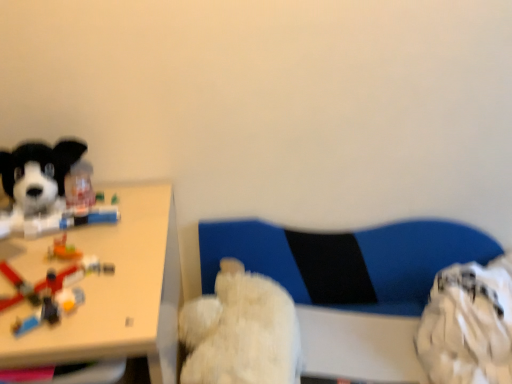
Describe the element at coordinates (116, 292) in the screenshot. I see `white plastic table at left` at that location.

Identify the location of fluffy white teddy bear at center, the second dog in the left-to-right sequence. The width and height of the screenshot is (512, 384). (241, 331).

Find the location of `white plastic table at left`. white plastic table at left is located at coordinates (116, 292).

Which is in front, translucent plastic toy at left or white plastic table at left?

white plastic table at left is more forward.

Is translucent plastic toy at left not near white plastic table at left?

translucent plastic toy at left is actually quite close to white plastic table at left.

Which of these two, translucent plastic toy at left or white plastic table at left, is wider?

Wider between the two is white plastic table at left.

Is blue fabric swivel chair at center positioned with its back to fluffy white teddy bear at center, the second dog in the left-to-right sequence?

blue fabric swivel chair at center is not turned away from fluffy white teddy bear at center, the second dog in the left-to-right sequence.

From a real-world perspective, is blue fabric swivel chair at center positioned over fluffy white teddy bear at center, which is the 1th dog in right-to-left order, based on gravity?

No.

Based on the photo, from the image's perspective, between blue fabric swivel chair at center and fluffy white teddy bear at center, the second dog in the left-to-right sequence, which one is located above?

blue fabric swivel chair at center appears higher in the image.

Choose the correct answer: Is blue fabric swivel chair at center inside fluffy white teddy bear at center, which is the 1th dog in right-to-left order, or outside it?

blue fabric swivel chair at center is spatially situated outside fluffy white teddy bear at center, which is the 1th dog in right-to-left order.

In the image, is fluffy white teddy bear at center, which is the 1th dog in right-to-left order, on the left side or the right side of soft plush dog at left, which is the first dog in top-to-bottom order?

Clearly, fluffy white teddy bear at center, which is the 1th dog in right-to-left order, is on the right of soft plush dog at left, which is the first dog in top-to-bottom order, in the image.

Considering the sizes of objects fluffy white teddy bear at center, which is counted as the second dog, starting from the top, and soft plush dog at left, the 1th dog when ordered from left to right, in the image provided, who is taller, fluffy white teddy bear at center, which is counted as the second dog, starting from the top, or soft plush dog at left, the 1th dog when ordered from left to right,?

With more height is fluffy white teddy bear at center, which is counted as the second dog, starting from the top.

Is fluffy white teddy bear at center, the second dog in the left-to-right sequence, beside soft plush dog at left, which is the first dog in top-to-bottom order?

No, fluffy white teddy bear at center, the second dog in the left-to-right sequence, is not making contact with soft plush dog at left, which is the first dog in top-to-bottom order.

Which object is positioned more to the right, fluffy white teddy bear at center, the second dog in the left-to-right sequence, or translucent plastic toy at left?

From the viewer's perspective, fluffy white teddy bear at center, the second dog in the left-to-right sequence, appears more on the right side.

From a real-world perspective, which is physically below, fluffy white teddy bear at center, the second dog in the left-to-right sequence, or translucent plastic toy at left?

From a 3D spatial view, fluffy white teddy bear at center, the second dog in the left-to-right sequence, is below.

Considering the points (287, 370) and (84, 297), which point is in front, point (287, 370) or point (84, 297)?

The point (84, 297) is closer to the camera.

Can you tell me how much fluffy white teddy bear at center, the 1th dog positioned from the bottom, and translucent plastic toy at left differ in facing direction?

There is a 4.24-degree angle between the facing directions of fluffy white teddy bear at center, the 1th dog positioned from the bottom, and translucent plastic toy at left.

Do you think soft plush dog at left, which is counted as the 2th dog, starting from the bottom, is within translucent plastic toy at left, or outside of it?

soft plush dog at left, which is counted as the 2th dog, starting from the bottom, is not enclosed by translucent plastic toy at left.

From the image's perspective, does soft plush dog at left, which is the first dog in top-to-bottom order, appear higher than translucent plastic toy at left?

Yes, from the image's perspective, soft plush dog at left, which is the first dog in top-to-bottom order, is above translucent plastic toy at left.

From a real-world perspective, is soft plush dog at left, which is the first dog in top-to-bottom order, physically above translucent plastic toy at left?

Yes, from a real-world perspective, soft plush dog at left, which is the first dog in top-to-bottom order, is above translucent plastic toy at left.

This screenshot has height=384, width=512. I want to click on toy that appears on the right of soft plush dog at left, the 1th dog when ordered from left to right, so click(x=51, y=291).

How many degrees apart are the facing directions of white plastic table at left and fluffy white teddy bear at center, which is counted as the second dog, starting from the top?

The angle between the facing direction of white plastic table at left and the facing direction of fluffy white teddy bear at center, which is counted as the second dog, starting from the top, is 2.17 degrees.

Consider the image. Does white plastic table at left have a lesser height compared to fluffy white teddy bear at center, the second dog in the left-to-right sequence?

Incorrect, the height of white plastic table at left does not fall short of that of fluffy white teddy bear at center, the second dog in the left-to-right sequence.

Locate an element on the screen. The height and width of the screenshot is (384, 512). table on the left of fluffy white teddy bear at center, which is counted as the second dog, starting from the top is located at coordinates (116, 292).

Which object is wider, white plastic table at left or fluffy white teddy bear at center, the 1th dog positioned from the bottom?

white plastic table at left.

From a real-world perspective, does soft plush dog at left, which ranks as the second dog in right-to-left order, stand above fluffy white teddy bear at center, which is counted as the second dog, starting from the top?

Yes, from a real-world perspective, soft plush dog at left, which ranks as the second dog in right-to-left order, is above fluffy white teddy bear at center, which is counted as the second dog, starting from the top.

Which is less distant, (40, 189) or (186, 318)?

Positioned in front is point (40, 189).

Find the location of `dog lying above the fluffy white teddy bear at center, the 1th dog positioned from the bottom (from the image's perspective)`. dog lying above the fluffy white teddy bear at center, the 1th dog positioned from the bottom (from the image's perspective) is located at coordinates (42, 190).

Between soft plush dog at left, which is the first dog in top-to-bottom order, and fluffy white teddy bear at center, which is counted as the second dog, starting from the top, which one has smaller width?

soft plush dog at left, which is the first dog in top-to-bottom order.

The height and width of the screenshot is (384, 512). In order to click on toy on the right of the white plastic table at left in this screenshot , I will do `click(51, 291)`.

In order to click on dog below the blue fabric swivel chair at center (from the image's perspective) in this screenshot , I will do `click(241, 331)`.

Estimate the real-world distances between objects in this image. Which object is closer to blue fabric swivel chair at center, white plastic table at left or translucent plastic toy at left?

Among the two, white plastic table at left is located nearer to blue fabric swivel chair at center.

Which object lies nearer to the anchor point fluffy white teddy bear at center, which is the 1th dog in right-to-left order, soft plush dog at left, the 1th dog when ordered from left to right, or white plastic table at left?

The object closer to fluffy white teddy bear at center, which is the 1th dog in right-to-left order, is white plastic table at left.

Based on their spatial positions, is soft plush dog at left, which is counted as the 2th dog, starting from the bottom, or fluffy white teddy bear at center, which is counted as the second dog, starting from the top, closer to white plastic table at left?

soft plush dog at left, which is counted as the 2th dog, starting from the bottom, lies closer to white plastic table at left than the other object.

Estimate the real-world distances between objects in this image. Which object is closer to soft plush dog at left, the 1th dog when ordered from left to right, white plastic table at left or blue fabric swivel chair at center?

white plastic table at left is positioned closer to the anchor soft plush dog at left, the 1th dog when ordered from left to right.

Based on their spatial positions, is fluffy white teddy bear at center, the 1th dog positioned from the bottom, or translucent plastic toy at left further from white plastic table at left?

fluffy white teddy bear at center, the 1th dog positioned from the bottom, is further to white plastic table at left.

Based on their spatial positions, is fluffy white teddy bear at center, the second dog in the left-to-right sequence, or blue fabric swivel chair at center closer to translucent plastic toy at left?

The object closer to translucent plastic toy at left is fluffy white teddy bear at center, the second dog in the left-to-right sequence.

When comparing their distances from blue fabric swivel chair at center, does fluffy white teddy bear at center, which is counted as the second dog, starting from the top, or white plastic table at left seem further?

white plastic table at left is further to blue fabric swivel chair at center.

Looking at the image, which one is located further to soft plush dog at left, which ranks as the second dog in right-to-left order, blue fabric swivel chair at center or white plastic table at left?

blue fabric swivel chair at center is further to soft plush dog at left, which ranks as the second dog in right-to-left order.

What are the coordinates of `toy located between white plastic table at left and blue fabric swivel chair at center in the left-right direction` in the screenshot? It's located at (51, 291).

You are a GUI agent. You are given a task and a screenshot of the screen. Output one action in this format:
    pyautogui.click(x=<x>, y=<y>)
    Task: Click on the toy between soft plush dog at left, which ranks as the second dog in right-to-left order, and white plastic table at left vertically
    
    Given the screenshot: What is the action you would take?
    pyautogui.click(x=51, y=291)

I want to click on dog between white plastic table at left and fluffy white teddy bear at center, which is counted as the second dog, starting from the top, from left to right, so click(42, 190).

At what (x,y) coordinates should I click in order to perform the action: click on dog situated between soft plush dog at left, the 1th dog when ordered from left to right, and blue fabric swivel chair at center from left to right. Please return your answer as a coordinate pair (x, y). Looking at the image, I should click on (241, 331).